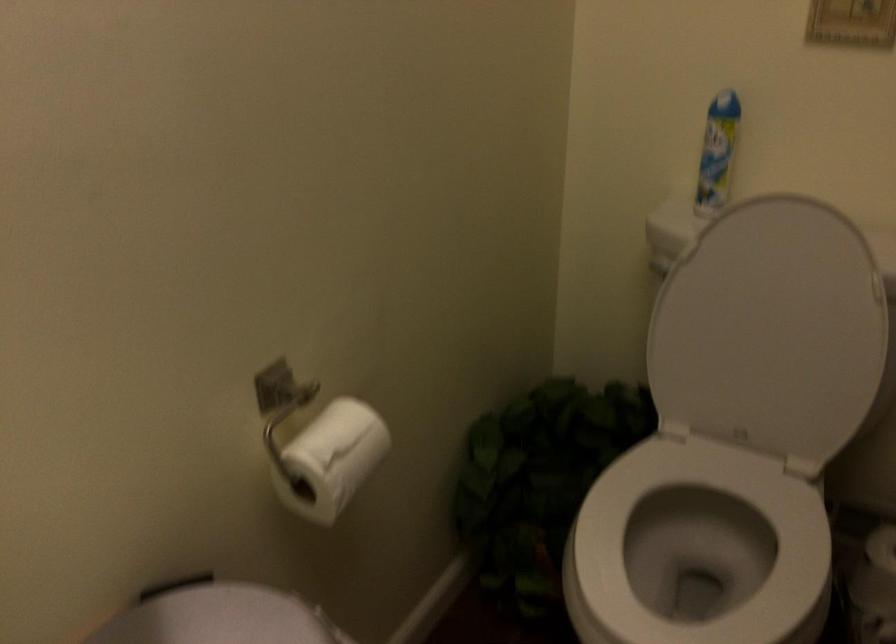
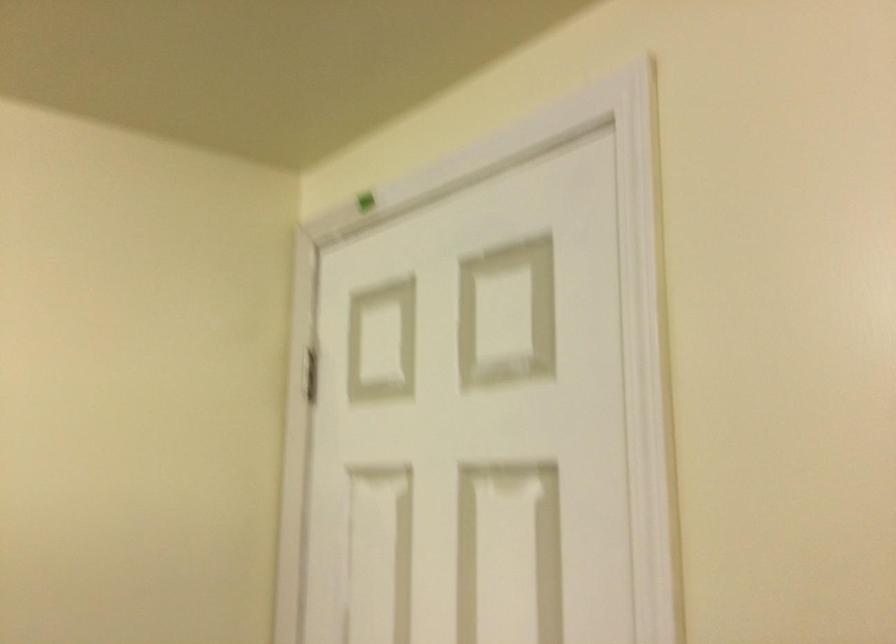
Question: The first image is from the beginning of the video and the second image is from the end. How did the camera likely rotate when shooting the video?

Choices:
 (A) Left
 (B) Right
 (C) Up
 (D) Down

Answer: (A)